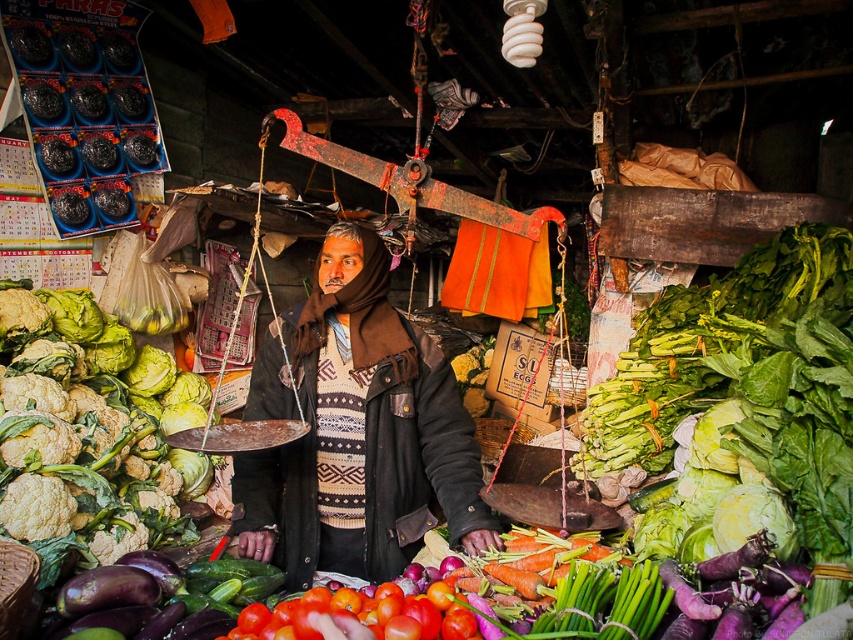
You are a customer at the market and want to place an order for both the green leafy cauliflower at left and the shiny red tomatoes at center. If your basket can only hold items within a 4 feet radius, will you be able to reach both items without moving your basket?

The distance between the green leafy cauliflower at left and the shiny red tomatoes at center is 4.13 feet, which exceeds the 4 feet radius of your basket. Therefore, you cannot reach both items without moving your basket.

You are a customer at the market and want to grab the shiny red tomatoes at center. However, the brown woolen scarf at center is blocking your view. Can you reach the tomatoes without moving the scarf?

The shiny red tomatoes at center is behind brown woolen scarf at center, so you can reach the tomatoes without moving the scarf since they are located behind it.